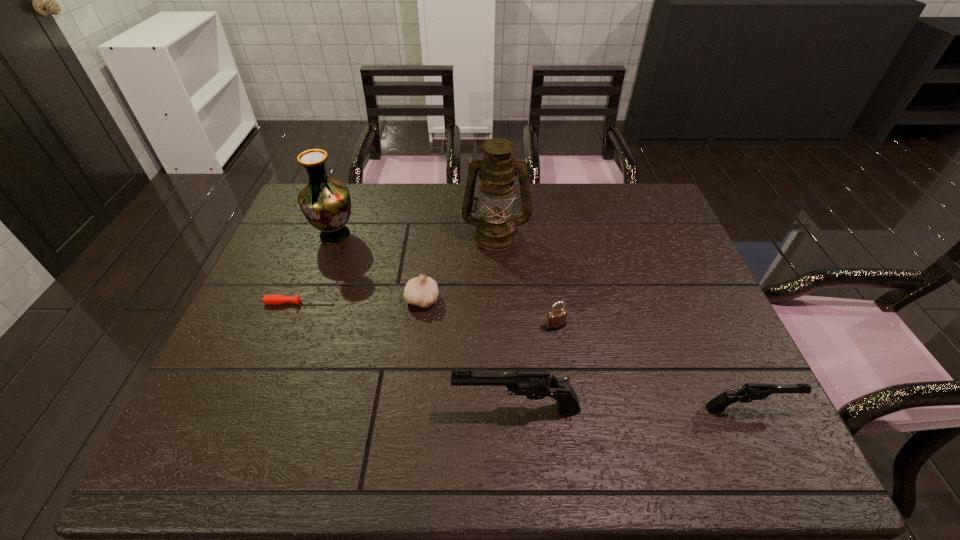
Where is `screwdriver that is at the left edge`? The width and height of the screenshot is (960, 540). screwdriver that is at the left edge is located at coordinates (267, 299).

Where is `object that is at the right edge`? The height and width of the screenshot is (540, 960). object that is at the right edge is located at coordinates (749, 392).

Identify the location of object present at the far left corner. Image resolution: width=960 pixels, height=540 pixels. (325, 202).

Find the location of a particular element. The height and width of the screenshot is (540, 960). object that is at the near right corner is located at coordinates (749, 392).

In the image, there is a desktop. Where is `vacant space at the far edge`? vacant space at the far edge is located at coordinates (382, 215).

Locate an element on the screen. vacant space at the near edge of the desktop is located at coordinates (505, 405).

In order to click on vacant space at the left edge in this screenshot , I will do `click(292, 327)`.

In the image, there is a desktop. Identify the location of vacant space at the right edge. This screenshot has width=960, height=540. (688, 371).

This screenshot has height=540, width=960. What are the coordinates of `vacant region at the far left corner of the desktop` in the screenshot? It's located at (300, 211).

In order to click on free space at the far right corner of the desktop in this screenshot , I will do `click(638, 197)`.